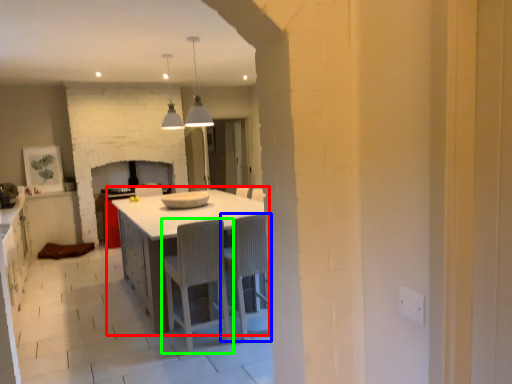
Question: Considering the real-world distances, which object is farthest from table (highlighted by a red box)? chair (highlighted by a blue box) or chair (highlighted by a green box)?

Choices:
 (A) chair
 (B) chair

Answer: (A)